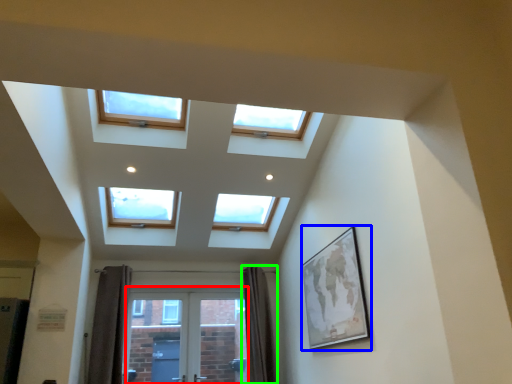
Question: Estimate the real-world distances between objects in this image. Which object is closer to screen door (highlighted by a red box), picture frame (highlighted by a blue box) or curtain (highlighted by a green box)?

Choices:
 (A) picture frame
 (B) curtain

Answer: (B)